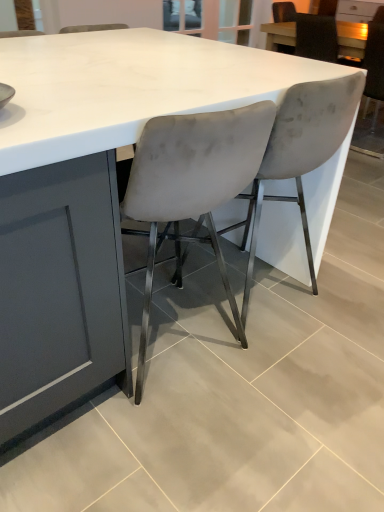
Question: From a real-world perspective, is velvet grey chair at center, which ranks as the 2th chair in left-to-right order, physically below matte white table at upper right?

Choices:
 (A) yes
 (B) no

Answer: (A)

Question: Can you confirm if velvet grey chair at center, which is counted as the second chair, starting from the right, is taller than matte white table at upper right?

Choices:
 (A) yes
 (B) no

Answer: (A)

Question: Does velvet grey chair at center, which is counted as the second chair, starting from the right, have a lesser height compared to matte white table at upper right?

Choices:
 (A) no
 (B) yes

Answer: (A)

Question: From the image's perspective, would you say velvet grey chair at center, which is counted as the second chair, starting from the right, is positioned over matte white table at upper right?

Choices:
 (A) no
 (B) yes

Answer: (A)

Question: From the image's perspective, is velvet grey chair at center, which is counted as the second chair, starting from the right, below matte white table at upper right?

Choices:
 (A) no
 (B) yes

Answer: (B)

Question: Is velvet gray chair at upper right, placed as the first chair when sorted from right to left, in front of or behind velvet grey chair at center, the 1th chair when ordered from front to back, in the image?

Choices:
 (A) front
 (B) behind

Answer: (B)

Question: From a real-world perspective, relative to velvet grey chair at center, the 1th chair when ordered from front to back, is velvet gray chair at upper right, placed as the first chair when sorted from right to left, vertically above or below?

Choices:
 (A) below
 (B) above

Answer: (A)

Question: Is velvet gray chair at upper right, the first chair in the back-to-front sequence, to the left or to the right of velvet grey chair at center, the 1th chair when ordered from front to back, in the image?

Choices:
 (A) left
 (B) right

Answer: (B)

Question: From the image's perspective, relative to velvet grey chair at center, which appears as the third chair when viewed from the back, is velvet gray chair at upper right, the first chair in the back-to-front sequence, above or below?

Choices:
 (A) below
 (B) above

Answer: (B)

Question: Is velvet gray chair at upper right, which is the third chair in left-to-right order, situated inside velvet grey chair at center, which ranks as the 2th chair in left-to-right order, or outside?

Choices:
 (A) inside
 (B) outside

Answer: (B)

Question: Relative to velvet grey chair at center, which is counted as the second chair, starting from the right, is velvet gray chair at upper right, which is the third chair in left-to-right order, in front or behind?

Choices:
 (A) front
 (B) behind

Answer: (B)

Question: Is velvet gray chair at upper right, which is the third chair in left-to-right order, wider or thinner than velvet grey chair at center, the second chair viewed from the back?

Choices:
 (A) thin
 (B) wide

Answer: (B)

Question: Is velvet gray chair at upper right, which is the third chair in left-to-right order, bigger or smaller than velvet grey chair at center, which ranks as the 2th chair in left-to-right order?

Choices:
 (A) small
 (B) big

Answer: (B)

Question: Considering the positions of velvet grey chair at center, which is counted as the second chair, starting from the right, and matte white table at upper right in the image, is velvet grey chair at center, which is counted as the second chair, starting from the right, bigger or smaller than matte white table at upper right?

Choices:
 (A) big
 (B) small

Answer: (A)

Question: Considering the positions of point (281, 165) and point (294, 25), is point (281, 165) closer or farther from the camera than point (294, 25)?

Choices:
 (A) farther
 (B) closer

Answer: (B)